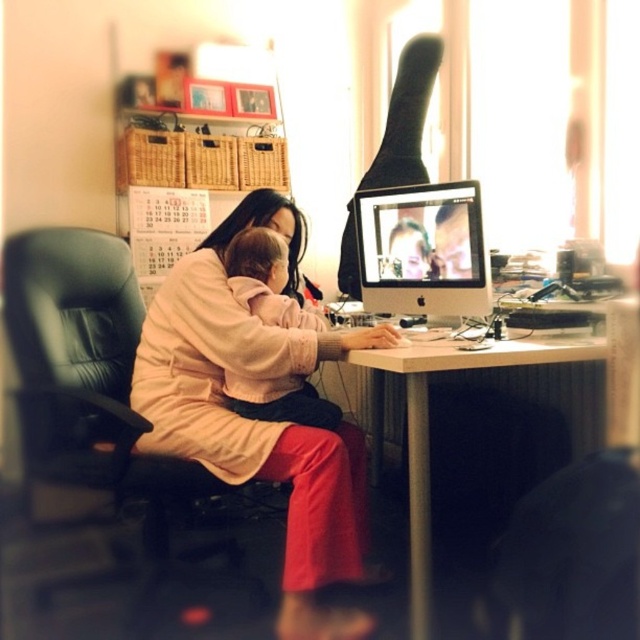
Question: Is light pink fabric coat at center above soft pink fabric baby at center?

Choices:
 (A) yes
 (B) no

Answer: (B)

Question: Which point appears closest to the camera in this image?

Choices:
 (A) (396, 365)
 (B) (474, 269)
 (C) (257, 243)
 (D) (163, 298)

Answer: (A)

Question: Is matte white monitor at center positioned at the back of soft pink fabric baby at center?

Choices:
 (A) yes
 (B) no

Answer: (A)

Question: Considering the real-world distances, which object is farthest from the soft pink fabric baby at center?

Choices:
 (A) light pink fabric coat at center
 (B) white glossy table at center

Answer: (B)

Question: Which object is closer to the camera taking this photo?

Choices:
 (A) white glossy table at center
 (B) soft pink fabric baby at center
 (C) black leather chair at left
 (D) light pink fabric coat at center

Answer: (A)

Question: Can you confirm if black leather chair at left is smaller than matte white monitor at center?

Choices:
 (A) no
 (B) yes

Answer: (A)